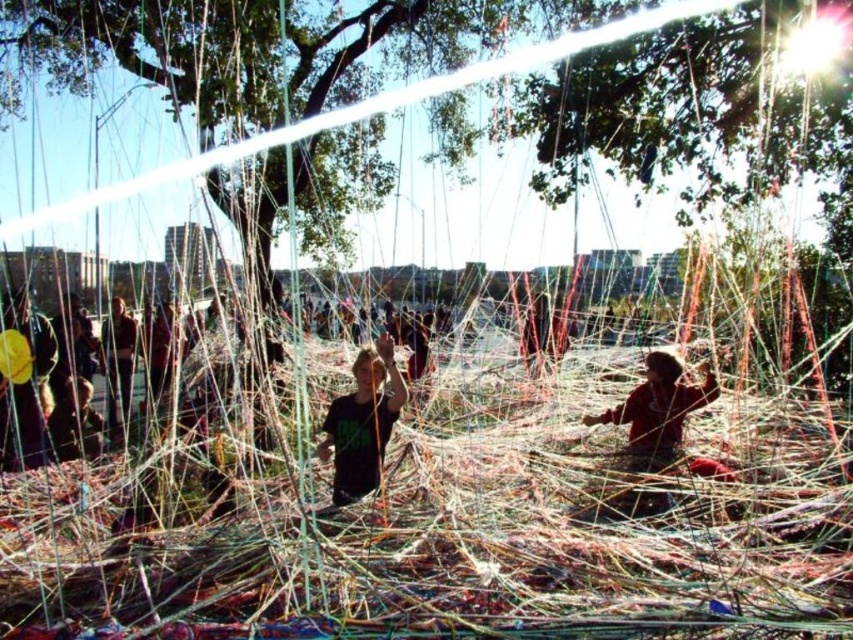
You are a photographer trying to capture a photo of the matte black shirt at center and the red fabric child at lower right in the same frame. Given that your camera has a maximum focal length of 50 meters, will you be able to include both subjects in the photo?

The matte black shirt at center and the red fabric child at lower right are 27.13 meters apart from each other. Since the camera can capture up to 50 meters, both subjects can be included in the photo as the distance between them is within the camera range.

You are a photographer trying to capture a clear shot of the matte black shirt at center and the red fabric child at lower right. Since the ropes are in the way, you need to adjust your position. Which object should you move closer to the camera to get both subjects in focus?

The matte black shirt at center is located below the red fabric child at lower right. To get both in focus, you should move the red fabric child at lower right closer to the camera since it is above the matte black shirt at center.